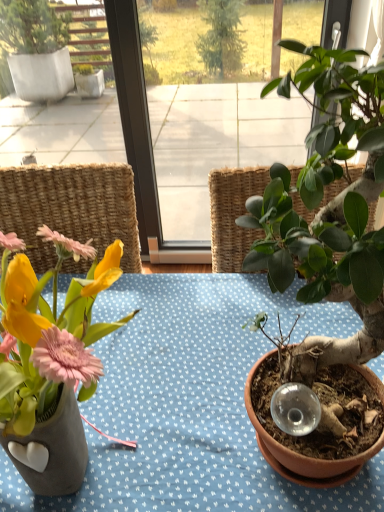
Question: Is matte ceramic vase at left surrounding green matte plant at right?

Choices:
 (A) yes
 (B) no

Answer: (B)

Question: From a real-world perspective, is matte ceramic vase at left positioned under green matte plant at right based on gravity?

Choices:
 (A) yes
 (B) no

Answer: (A)

Question: Is matte ceramic vase at left directly adjacent to green matte plant at right?

Choices:
 (A) no
 (B) yes

Answer: (A)

Question: Does matte ceramic vase at left have a greater width compared to green matte plant at right?

Choices:
 (A) no
 (B) yes

Answer: (B)

Question: From the image's perspective, is matte ceramic vase at left over green matte plant at right?

Choices:
 (A) yes
 (B) no

Answer: (B)

Question: Is matte ceramic vase at left closer to camera compared to green matte plant at right?

Choices:
 (A) yes
 (B) no

Answer: (B)

Question: Is green matte plant at right not within matte ceramic vase at left?

Choices:
 (A) yes
 (B) no

Answer: (A)

Question: Could you tell me if green matte plant at right is turned towards matte ceramic vase at left?

Choices:
 (A) no
 (B) yes

Answer: (A)

Question: Can you confirm if green matte plant at right is shorter than matte ceramic vase at left?

Choices:
 (A) yes
 (B) no

Answer: (B)

Question: Considering the relative sizes of green matte plant at right and matte ceramic vase at left in the image provided, is green matte plant at right thinner than matte ceramic vase at left?

Choices:
 (A) yes
 (B) no

Answer: (A)

Question: Is green matte plant at right taller than matte ceramic vase at left?

Choices:
 (A) yes
 (B) no

Answer: (A)

Question: From a real-world perspective, does green matte plant at right stand above matte ceramic vase at left?

Choices:
 (A) yes
 (B) no

Answer: (A)

Question: From the image's perspective, is matte ceramic vase at left positioned above or below green matte plant at right?

Choices:
 (A) below
 (B) above

Answer: (A)